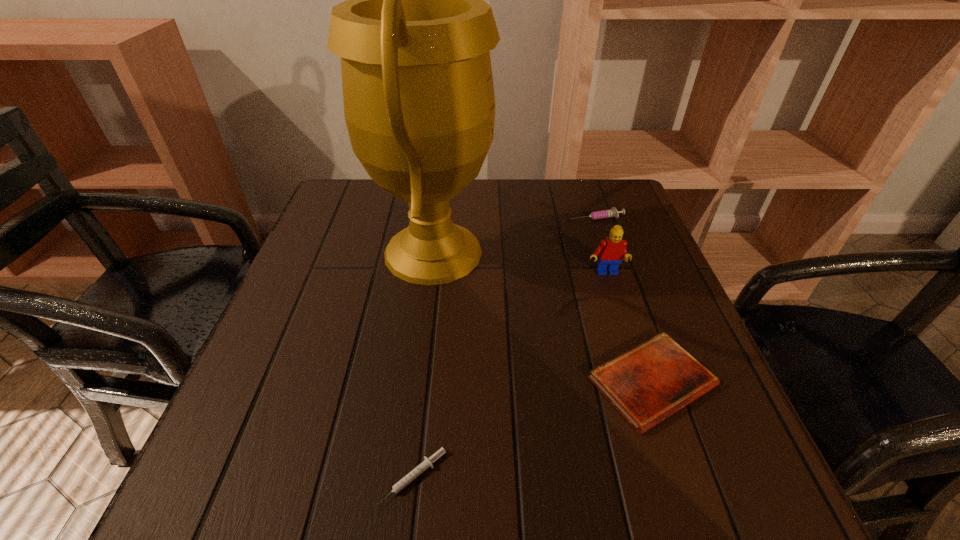
Locate an element on the screen. object present at the far right corner is located at coordinates (613, 212).

Identify the location of free spot at the far edge of the desktop. (468, 188).

Find the location of a particular element. The width and height of the screenshot is (960, 540). vacant space at the near edge of the desktop is located at coordinates point(594,515).

In the image, there is a desktop. At what (x,y) coordinates should I click in order to perform the action: click on vacant space at the left edge. Please return your answer as a coordinate pair (x, y). This screenshot has height=540, width=960. Looking at the image, I should click on (352, 286).

Find the location of a particular element. The image size is (960, 540). vacant region at the right edge of the desktop is located at coordinates (593, 236).

You are a GUI agent. You are given a task and a screenshot of the screen. Output one action in this format:
    pyautogui.click(x=<x>, y=<y>)
    Task: Click on the free location at the far left corner of the desktop
    
    Given the screenshot: What is the action you would take?
    pyautogui.click(x=343, y=205)

The width and height of the screenshot is (960, 540). I want to click on vacant space at the near left corner of the desktop, so click(x=286, y=462).

In the image, there is a desktop. Where is `vacant area at the far right corner`? vacant area at the far right corner is located at coordinates (601, 204).

This screenshot has height=540, width=960. In order to click on free point between the left syringe and the diary in this screenshot , I will do `click(532, 430)`.

Find the location of a particular element. This screenshot has height=540, width=960. vacant space that is in between the shortest object and the diary is located at coordinates (532, 430).